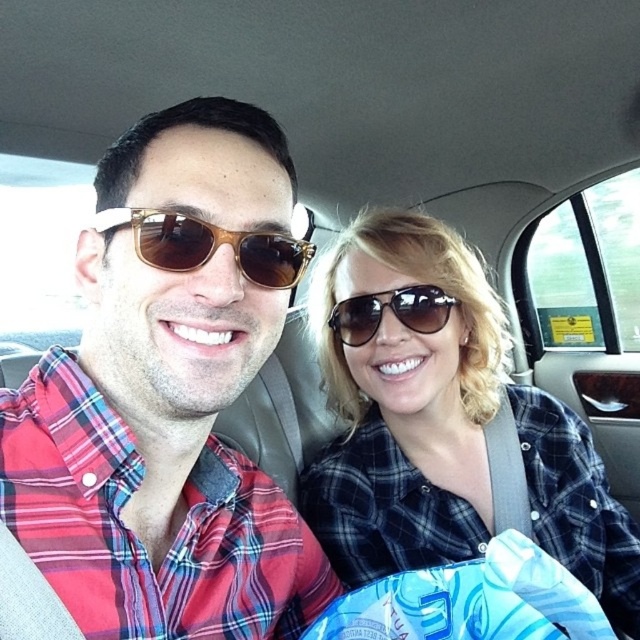
Can you confirm if matte black sunglasses at upper center is positioned to the left of brown wood sunglasses at center?

In fact, matte black sunglasses at upper center is to the right of brown wood sunglasses at center.

Which of these two, matte black sunglasses at upper center or brown wood sunglasses at center, stands taller?

matte black sunglasses at upper center

Who is more forward, (476, 340) or (180, 237)?

Point (180, 237) is in front.

At what (x,y) coordinates should I click in order to perform the action: click on matte black sunglasses at upper center. Please return your answer as a coordinate pair (x, y). Looking at the image, I should click on (442, 420).

Does brown wood sunglasses at center appear over sunglasses at center?

Yes.

Between brown wood sunglasses at center and sunglasses at center, which one is positioned higher?

brown wood sunglasses at center is above.

The width and height of the screenshot is (640, 640). Describe the element at coordinates (209, 244) in the screenshot. I see `brown wood sunglasses at center` at that location.

What are the coordinates of `brown wood sunglasses at center` in the screenshot? It's located at (209, 244).

Can you confirm if matte plaid shirt at center is bigger than matte black sunglasses at upper center?

No.

Can you confirm if matte plaid shirt at center is wider than matte black sunglasses at upper center?

No.

Is point (275, 122) positioned before point (362, 353)?

No, (275, 122) is further to viewer.

Where is `matte plaid shirt at center`? This screenshot has width=640, height=640. matte plaid shirt at center is located at coordinates [168, 396].